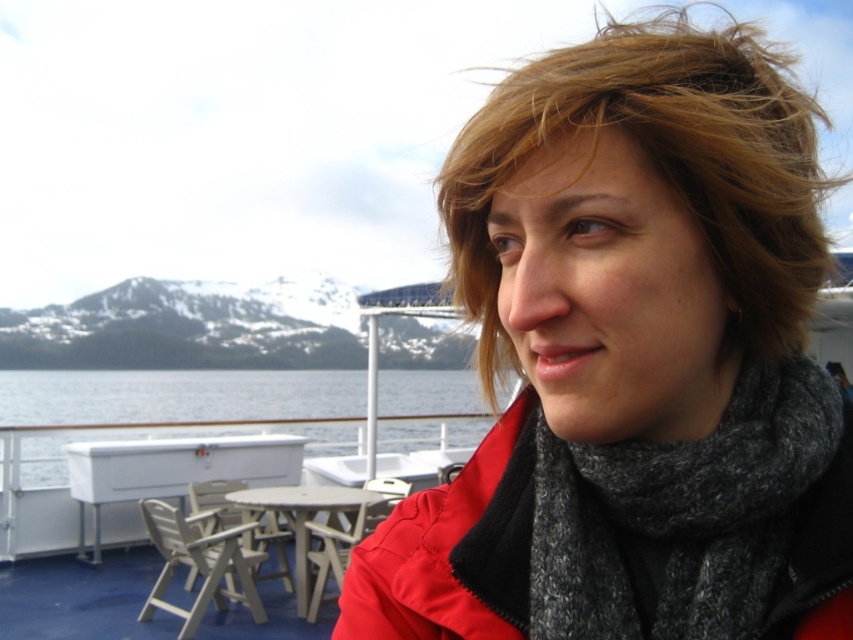
Which is below, matte red jacket at center or clear water at lower left?

clear water at lower left

Does matte red jacket at center appear on the left side of clear water at lower left?

Incorrect, matte red jacket at center is not on the left side of clear water at lower left.

Is point (712, 636) positioned before point (309, 390)?

Yes, it is in front of point (309, 390).

The image size is (853, 640). Identify the location of matte red jacket at center. (628, 353).

Is point (809, 278) less distant than point (770, 627)?

No.

Locate an element on the screen. This screenshot has width=853, height=640. matte red jacket at center is located at coordinates (628, 353).

What are the coordinates of `matte red jacket at center` in the screenshot? It's located at (628, 353).

Can you confirm if gray woolen scarf at right is positioned to the left of clear water at lower left?

Incorrect, gray woolen scarf at right is not on the left side of clear water at lower left.

Can you confirm if gray woolen scarf at right is bigger than clear water at lower left?

Actually, gray woolen scarf at right might be smaller than clear water at lower left.

Who is more forward, [647,564] or [170,400]?

Point [647,564]

Locate an element on the screen. gray woolen scarf at right is located at coordinates (683, 516).